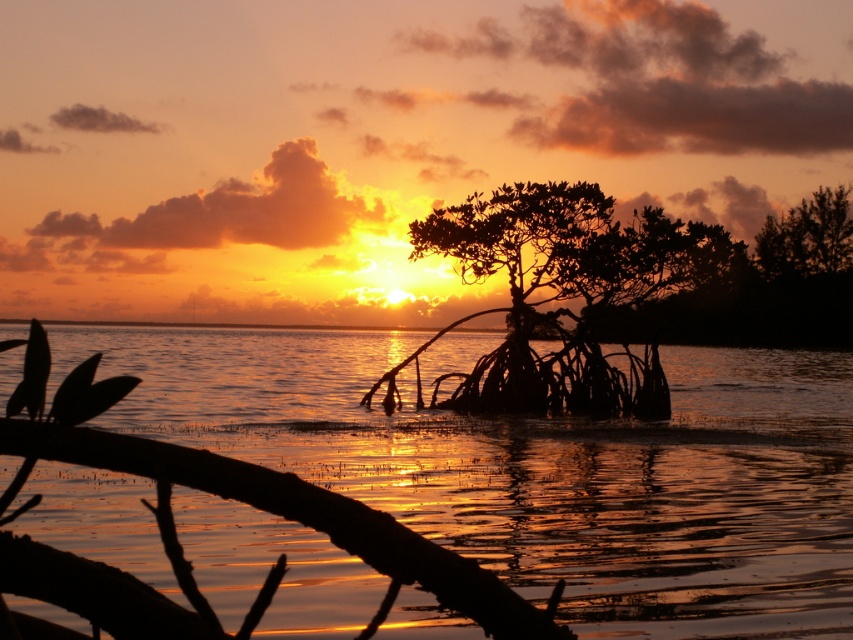
Question: Among these objects, which one is farthest from the camera?

Choices:
 (A) silhouette wood at center
 (B) glistening water at center

Answer: (A)

Question: From the image, what is the correct spatial relationship of glistening water at center in relation to silhouette wood at center?

Choices:
 (A) above
 (B) below

Answer: (B)

Question: Which object appears farthest from the camera in this image?

Choices:
 (A) glistening water at center
 (B) silhouette wood at center

Answer: (B)

Question: Is glistening water at center positioned at the back of silhouette wood at center?

Choices:
 (A) no
 (B) yes

Answer: (A)

Question: Where is glistening water at center located in relation to silhouette wood at center in the image?

Choices:
 (A) above
 (B) below

Answer: (B)

Question: Which point is closer to the camera?

Choices:
 (A) silhouette wood at center
 (B) glistening water at center

Answer: (B)